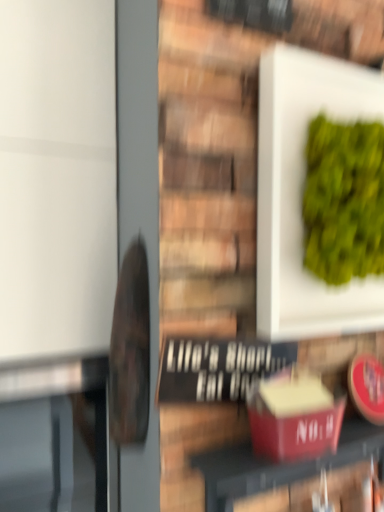
Question: From the image's perspective, is white matte plate at upper right located above matte red box at center?

Choices:
 (A) yes
 (B) no

Answer: (A)

Question: Is white matte plate at upper right at the right side of matte red box at center?

Choices:
 (A) no
 (B) yes

Answer: (B)

Question: Could you tell me if white matte plate at upper right is turned towards matte red box at center?

Choices:
 (A) no
 (B) yes

Answer: (A)

Question: Is white matte plate at upper right touching matte red box at center?

Choices:
 (A) yes
 (B) no

Answer: (B)

Question: Is matte red box at center a part of white matte plate at upper right?

Choices:
 (A) no
 (B) yes

Answer: (A)

Question: Is white matte plate at upper right taller than matte red box at center?

Choices:
 (A) yes
 (B) no

Answer: (A)

Question: Considering the relative sizes of matte red box at center and white matte plate at upper right in the image provided, is matte red box at center thinner than white matte plate at upper right?

Choices:
 (A) no
 (B) yes

Answer: (B)

Question: From the image's perspective, does matte red box at center appear higher than white matte plate at upper right?

Choices:
 (A) no
 (B) yes

Answer: (A)

Question: From a real-world perspective, does matte red box at center stand above white matte plate at upper right?

Choices:
 (A) yes
 (B) no

Answer: (B)

Question: Can you confirm if matte red box at center is bigger than white matte plate at upper right?

Choices:
 (A) yes
 (B) no

Answer: (B)

Question: Is matte red box at center behind white matte plate at upper right?

Choices:
 (A) yes
 (B) no

Answer: (B)

Question: From a real-world perspective, does matte red box at center sit lower than white matte plate at upper right?

Choices:
 (A) no
 (B) yes

Answer: (B)

Question: Is point coord(276,67) closer or farther from the camera than point coord(274,462)?

Choices:
 (A) closer
 (B) farther

Answer: (B)